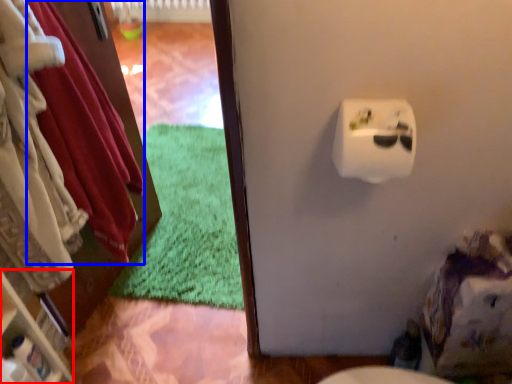
Question: Among these objects, which one is nearest to the camera, shelf (highlighted by a red box) or clothing (highlighted by a blue box)?

Choices:
 (A) shelf
 (B) clothing

Answer: (B)